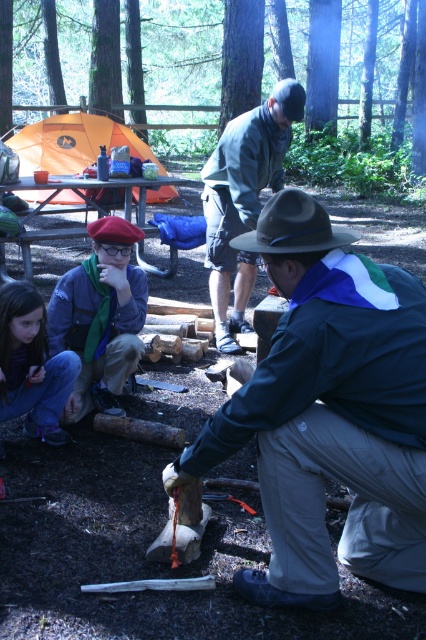
Does gray fabric jacket at center have a smaller size compared to orange fabric tent at upper left?

Correct, gray fabric jacket at center occupies less space than orange fabric tent at upper left.

Between point (216, 204) and point (150, 195), which one is positioned in front?

Point (216, 204) is in front.

The width and height of the screenshot is (426, 640). I want to click on gray fabric jacket at center, so click(x=244, y=198).

Can you confirm if matte blue shirt at center is bigger than gray fabric jacket at center?

Actually, matte blue shirt at center might be smaller than gray fabric jacket at center.

Between matte blue shirt at center and gray fabric jacket at center, which one appears on the right side from the viewer's perspective?

Positioned to the right is gray fabric jacket at center.

Which is in front, point (114, 276) or point (267, 168)?

Positioned in front is point (114, 276).

The width and height of the screenshot is (426, 640). Find the location of `matte blue shirt at center`. matte blue shirt at center is located at coordinates (100, 316).

From the picture: Is matte blue shirt at center below orange fabric tent at upper left?

Indeed, matte blue shirt at center is positioned under orange fabric tent at upper left.

The height and width of the screenshot is (640, 426). I want to click on matte blue shirt at center, so click(100, 316).

Does point (115, 406) lie in front of point (68, 163)?

Yes, point (115, 406) is in front of point (68, 163).

Where is `matte blue shirt at center`? Image resolution: width=426 pixels, height=640 pixels. matte blue shirt at center is located at coordinates (100, 316).